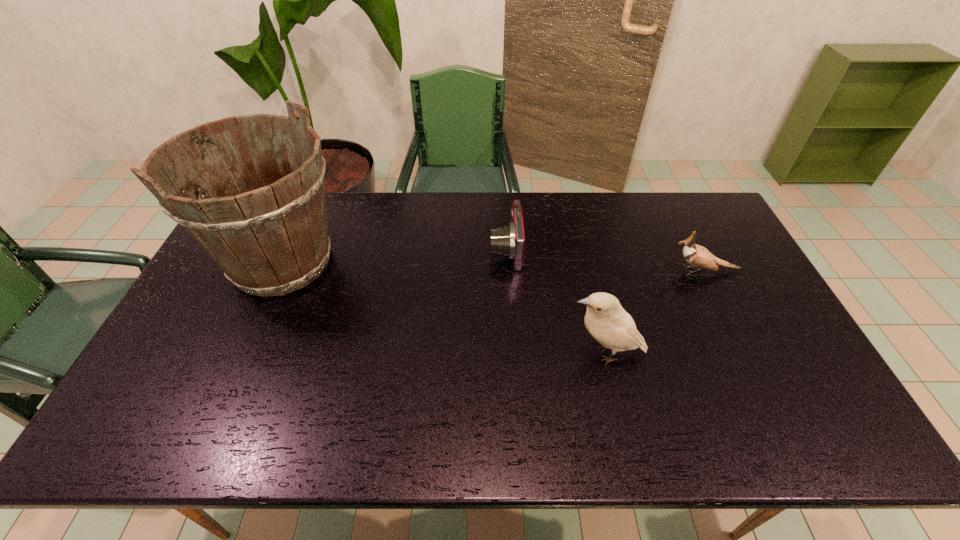
Image resolution: width=960 pixels, height=540 pixels. In order to click on empty location between the bucket and the shortest object in this screenshot , I will do `click(394, 256)`.

Image resolution: width=960 pixels, height=540 pixels. I want to click on free space that is in between the shortest object and the taller bird, so click(x=555, y=302).

Image resolution: width=960 pixels, height=540 pixels. I want to click on free space between the shortest object and the shorter bird, so click(605, 260).

Find the location of a particular element. blank region between the second object from right to left and the shortest object is located at coordinates (555, 302).

Locate an element on the screen. The image size is (960, 540). free space between the leftmost object and the taller bird is located at coordinates (444, 308).

The width and height of the screenshot is (960, 540). Identify the location of vacant point located between the third object from left to right and the camera. (555, 302).

This screenshot has width=960, height=540. I want to click on free space between the third object from right to left and the bucket, so click(x=394, y=256).

The width and height of the screenshot is (960, 540). What are the coordinates of `object that stands as the third closest to the camera` in the screenshot? It's located at (696, 255).

Locate an element on the screen. object that is the third closest to the shortest object is located at coordinates (696, 255).